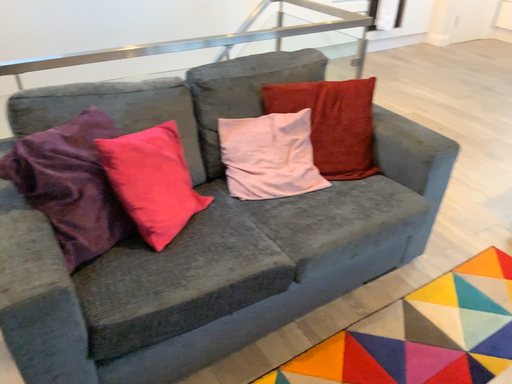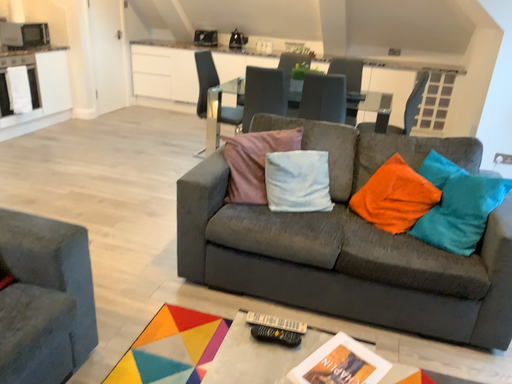
Question: How did the camera likely rotate when shooting the video?

Choices:
 (A) rotated right
 (B) rotated left

Answer: (A)